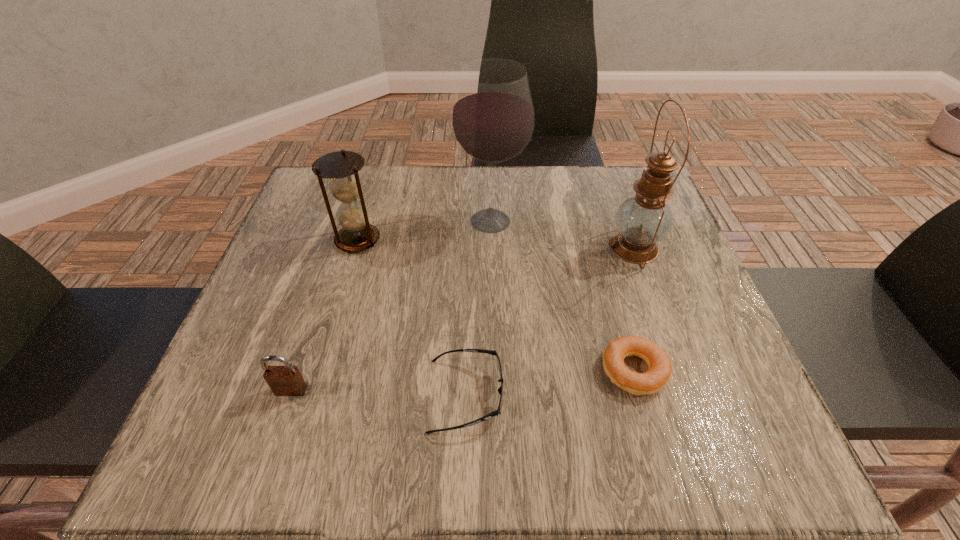
You are a GUI agent. You are given a task and a screenshot of the screen. Output one action in this format:
    pyautogui.click(x=<x>, y=<y>)
    Task: Click on the vacant space at the left edge of the desktop
    The image size is (960, 540).
    Given the screenshot: What is the action you would take?
    pyautogui.click(x=281, y=278)

Identify the location of blank space at the right edge of the desktop. This screenshot has width=960, height=540. (683, 388).

In the image, there is a desktop. Where is `vacant space at the near left corner`? Image resolution: width=960 pixels, height=540 pixels. vacant space at the near left corner is located at coordinates (280, 470).

You are a GUI agent. You are given a task and a screenshot of the screen. Output one action in this format:
    pyautogui.click(x=<x>, y=<y>)
    Task: Click on the free region at the near right corner of the desktop
    
    Given the screenshot: What is the action you would take?
    pyautogui.click(x=685, y=435)

At what (x,y) coordinates should I click in order to perform the action: click on free point between the alcohol and the sunglasses. Please return your answer as a coordinate pair (x, y). Looking at the image, I should click on (478, 308).

Image resolution: width=960 pixels, height=540 pixels. In order to click on unoccupied position between the fifth tallest object and the padlock in this screenshot , I will do `click(378, 393)`.

Identify the location of free spot between the padlock and the sunglasses. (378, 393).

Find the location of a particular element. free point between the bagel and the alcohol is located at coordinates (563, 296).

Find the location of a particular element. This screenshot has width=960, height=540. vacant space that's between the oil lamp and the alcohol is located at coordinates (563, 234).

Where is `vacant space that's between the sunglasses and the hourglass`? vacant space that's between the sunglasses and the hourglass is located at coordinates (412, 318).